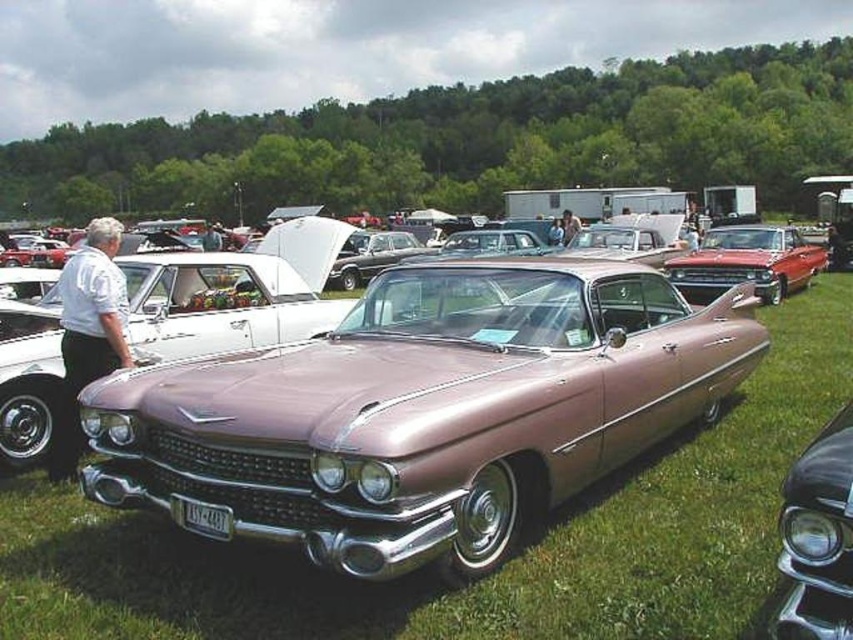
Question: Which point is closer to the camera taking this photo?

Choices:
 (A) (817, 244)
 (B) (468, 490)
 (C) (813, 460)
 (D) (73, 372)

Answer: (C)

Question: Is white shirt at left below shiny red car at center?

Choices:
 (A) yes
 (B) no

Answer: (A)

Question: Which of these objects is positioned closest to the glossy black headlight at lower right?

Choices:
 (A) shiny red car at center
 (B) metallic purple car at center
 (C) white shirt at left

Answer: (B)

Question: Which of the following is the closest to the observer?

Choices:
 (A) shiny red car at center
 (B) metallic purple car at center
 (C) glossy black headlight at lower right

Answer: (C)

Question: Is glossy black headlight at lower right behind white shirt at left?

Choices:
 (A) no
 (B) yes

Answer: (A)

Question: Is glossy black headlight at lower right behind white shirt at left?

Choices:
 (A) yes
 (B) no

Answer: (B)